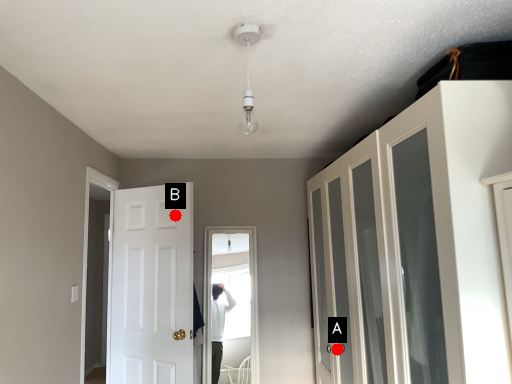
Question: Two points are circled on the image, labeled by A and B beside each circle. Which point is closer to the camera taking this photo?

Choices:
 (A) A is closer
 (B) B is closer

Answer: (A)